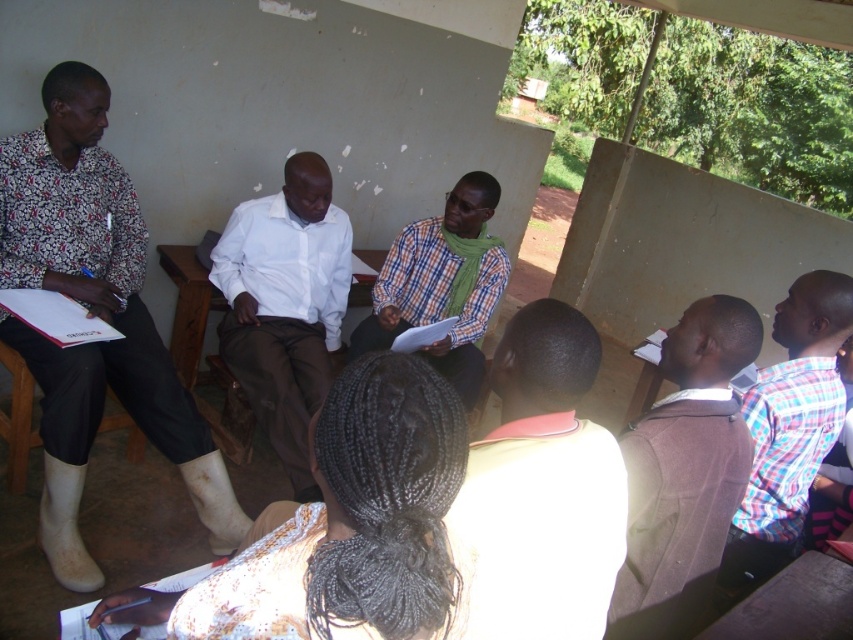
Between white matte shirt at center and white shirt at center, which one has more height?

Standing taller between the two is white shirt at center.

This screenshot has height=640, width=853. I want to click on white matte shirt at center, so click(x=540, y=490).

Can you confirm if plaid fabric shirt at right is shorter than checkered fabric shirt at center?

Indeed, plaid fabric shirt at right has a lesser height compared to checkered fabric shirt at center.

In the scene shown: Who is more distant from viewer, (756, 413) or (450, 289)?

The point (450, 289) is behind.

Locate an element on the screen. This screenshot has width=853, height=640. plaid fabric shirt at right is located at coordinates (788, 429).

Between white matte shirt at center and checkered fabric shirt at center, which one appears on the right side from the viewer's perspective?

white matte shirt at center is more to the right.

Describe the element at coordinates (540, 490) in the screenshot. I see `white matte shirt at center` at that location.

What are the coordinates of `white matte shirt at center` in the screenshot? It's located at (540, 490).